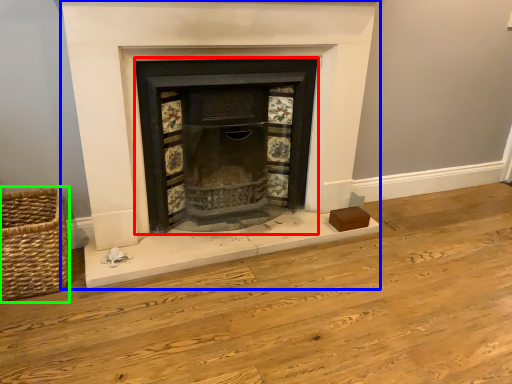
Question: Which is nearer to the wood burning stove (highlighted by a red box)? fireplace (highlighted by a blue box) or basket (highlighted by a green box).

Choices:
 (A) fireplace
 (B) basket

Answer: (A)